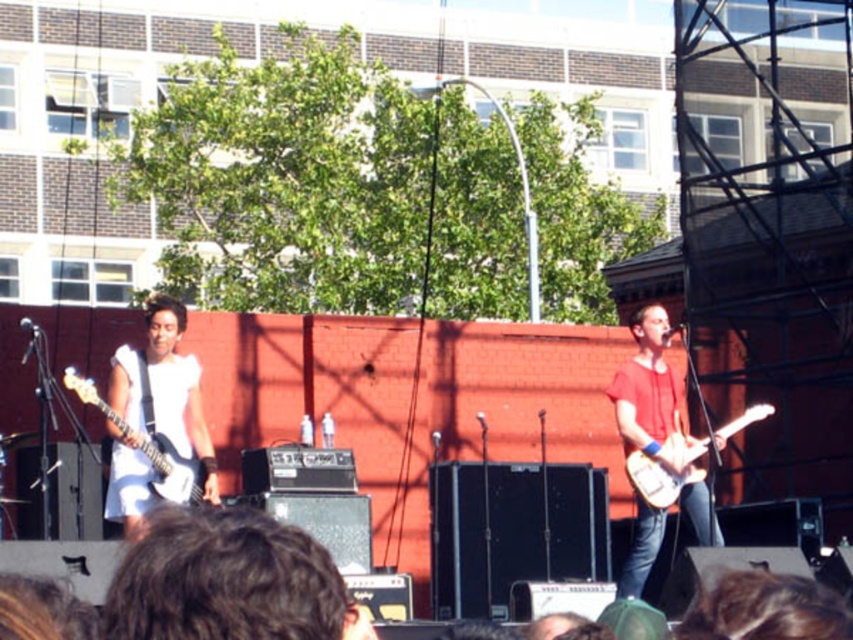
You are a photographer trying to capture the stage from the audience perspective. You notice two points marked in the image. Which of these points, point (x=206, y=433) or point (x=627, y=586), is closer to your camera lens?

Point (x=206, y=433) is closer to the camera than point (x=627, y=586).

You are at the front of the stage and want to hand the matte red guitar at right to the bass player who is at the left side of the stage. Can you reach them without moving?

The distance between you and the bass player is 34.59 meters, so you cannot reach them without moving as that distance is too far.

You are a photographer trying to capture a closeup of the white matte guitar at left and the white glossy electric guitar at right. Which guitar should you zoom in on if you want to focus on the thinner one?

The white matte guitar at left is thinner than the white glossy electric guitar at right, so you should zoom in on the white matte guitar at left to focus on the thinner one.